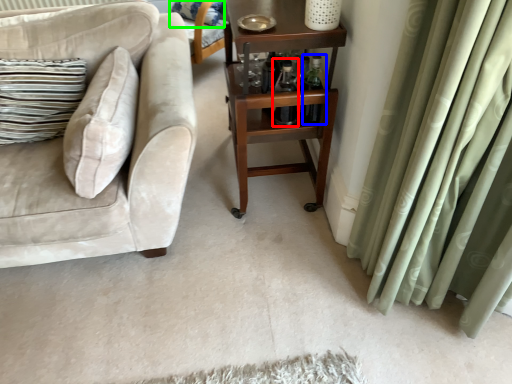
Question: Estimate the real-world distances between objects in this image. Which object is farther from bottle (highlighted by a red box), bottle (highlighted by a blue box) or pillow (highlighted by a green box)?

Choices:
 (A) bottle
 (B) pillow

Answer: (B)